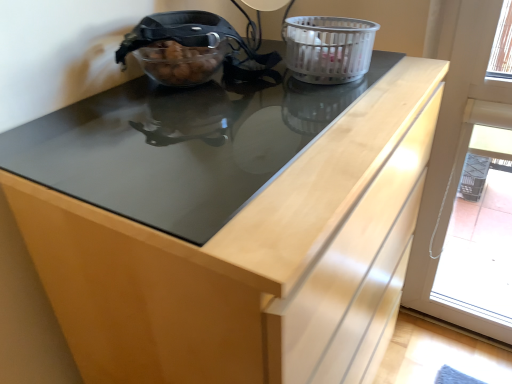
Locate an element on the screen. translucent plastic basket at upper right is located at coordinates (328, 48).

What do you see at coordinates (328, 48) in the screenshot? I see `translucent plastic basket at upper right` at bounding box center [328, 48].

Measure the distance between point (448, 146) and camera.

1.24 meters.

The image size is (512, 384). What do you see at coordinates (457, 149) in the screenshot?
I see `transparent plastic screen door at right` at bounding box center [457, 149].

Locate an element on the screen. Image resolution: width=512 pixels, height=384 pixels. transparent plastic screen door at right is located at coordinates (457, 149).

Identify the location of translucent plastic basket at upper right. (328, 48).

Considering the relative positions of translucent plastic basket at upper right and transparent plastic screen door at right in the image provided, is translucent plastic basket at upper right to the left of transparent plastic screen door at right from the viewer's perspective?

Yes.

Does translucent plastic basket at upper right lie in front of transparent plastic screen door at right?

Yes, it is.

Which point is more forward, (305, 31) or (478, 3)?

Answer: The point (305, 31) is more forward.

From the image's perspective, is translucent plastic basket at upper right below transparent plastic screen door at right?

No, from the image's perspective, translucent plastic basket at upper right is not below transparent plastic screen door at right.

From a real-world perspective, is translucent plastic basket at upper right below transparent plastic screen door at right?

Actually, translucent plastic basket at upper right is physically above transparent plastic screen door at right in the real world.

Considering the sizes of translucent plastic basket at upper right and transparent plastic screen door at right in the image, is translucent plastic basket at upper right wider or thinner than transparent plastic screen door at right?

In the image, translucent plastic basket at upper right appears to be wider than transparent plastic screen door at right.

Considering the relative sizes of translucent plastic basket at upper right and transparent plastic screen door at right in the image provided, is translucent plastic basket at upper right taller than transparent plastic screen door at right?

No, translucent plastic basket at upper right is not taller than transparent plastic screen door at right.

Considering the sizes of objects translucent plastic basket at upper right and transparent plastic screen door at right in the image provided, who is smaller, translucent plastic basket at upper right or transparent plastic screen door at right?

translucent plastic basket at upper right.

Would you say transparent plastic screen door at right is part of translucent plastic basket at upper right's contents?

No, transparent plastic screen door at right is not surrounded by translucent plastic basket at upper right.

Is translucent plastic basket at upper right placed right next to transparent plastic screen door at right?

No, translucent plastic basket at upper right is not next to transparent plastic screen door at right.

Is translucent plastic basket at upper right facing away from transparent plastic screen door at right?

translucent plastic basket at upper right is not turned away from transparent plastic screen door at right.

How different are the orientations of translucent plastic basket at upper right and transparent plastic screen door at right in degrees?

The angular difference between translucent plastic basket at upper right and transparent plastic screen door at right is 93 degrees.

How far apart are translucent plastic basket at upper right and transparent plastic screen door at right?

translucent plastic basket at upper right is 52.55 centimeters away from transparent plastic screen door at right.

Where is `basket container above the transparent plastic screen door at right (from the image's perspective)`? basket container above the transparent plastic screen door at right (from the image's perspective) is located at coordinates (328, 48).

Considering the relative positions of transparent plastic screen door at right and translucent plastic basket at upper right in the image provided, is transparent plastic screen door at right to the left or to the right of translucent plastic basket at upper right?

From the image, it's evident that transparent plastic screen door at right is to the right of translucent plastic basket at upper right.

In the image, is transparent plastic screen door at right positioned in front of or behind translucent plastic basket at upper right?

Visually, transparent plastic screen door at right is located behind translucent plastic basket at upper right.

Which is closer, (x=474, y=9) or (x=312, y=66)?

Point (x=474, y=9).

From the image's perspective, which one is positioned higher, transparent plastic screen door at right or translucent plastic basket at upper right?

translucent plastic basket at upper right appears higher in the image.

From a real-world perspective, which is physically below, transparent plastic screen door at right or translucent plastic basket at upper right?

transparent plastic screen door at right.

Considering the sizes of objects transparent plastic screen door at right and translucent plastic basket at upper right in the image provided, who is wider, transparent plastic screen door at right or translucent plastic basket at upper right?

With larger width is translucent plastic basket at upper right.

Is transparent plastic screen door at right shorter than translucent plastic basket at upper right?

Incorrect, the height of transparent plastic screen door at right does not fall short of that of translucent plastic basket at upper right.

Does transparent plastic screen door at right have a smaller size compared to translucent plastic basket at upper right?

Incorrect, transparent plastic screen door at right is not smaller in size than translucent plastic basket at upper right.

Is translucent plastic basket at upper right a part of transparent plastic screen door at right?

No, translucent plastic basket at upper right is not a part of transparent plastic screen door at right.

Is transparent plastic screen door at right placed right next to translucent plastic basket at upper right?

No, transparent plastic screen door at right is not beside translucent plastic basket at upper right.

Is transparent plastic screen door at right positioned with its back to translucent plastic basket at upper right?

No, transparent plastic screen door at right is not facing the opposite direction of translucent plastic basket at upper right.

How different are the orientations of transparent plastic screen door at right and translucent plastic basket at upper right in degrees?

They differ by 93 degrees in their facing directions.

Consider the image. How much distance is there between transparent plastic screen door at right and translucent plastic basket at upper right?

transparent plastic screen door at right is 20.69 inches away from translucent plastic basket at upper right.

At what (x,y) coordinates should I click in order to perform the action: click on basket container positioned vertically above the transparent plastic screen door at right (from a real-world perspective). Please return your answer as a coordinate pair (x, y). Looking at the image, I should click on (328, 48).

The height and width of the screenshot is (384, 512). In the image, there is a translucent plastic basket at upper right. Identify the location of screen door below it (from a real-world perspective). (457, 149).

Identify the location of basket container in front of the transparent plastic screen door at right. Image resolution: width=512 pixels, height=384 pixels. (328, 48).